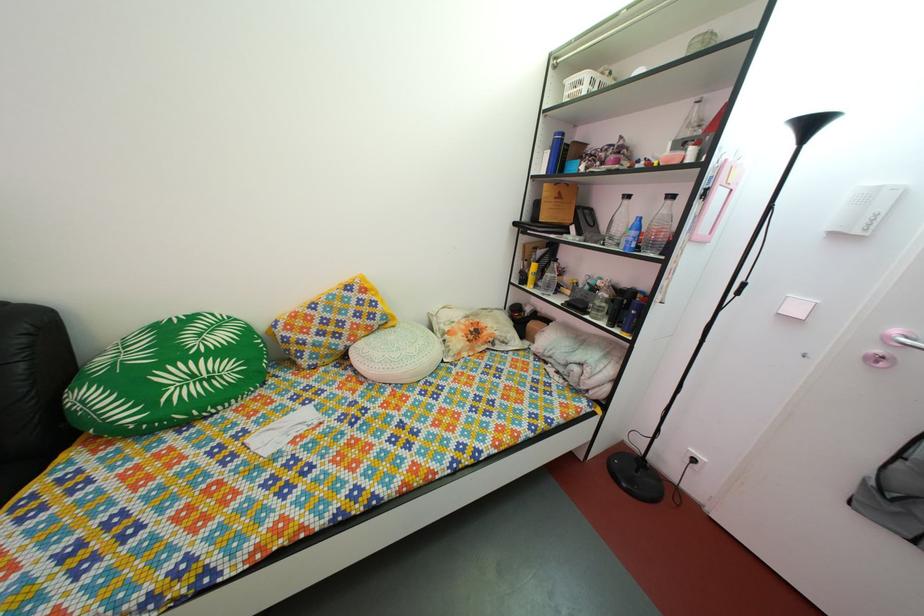
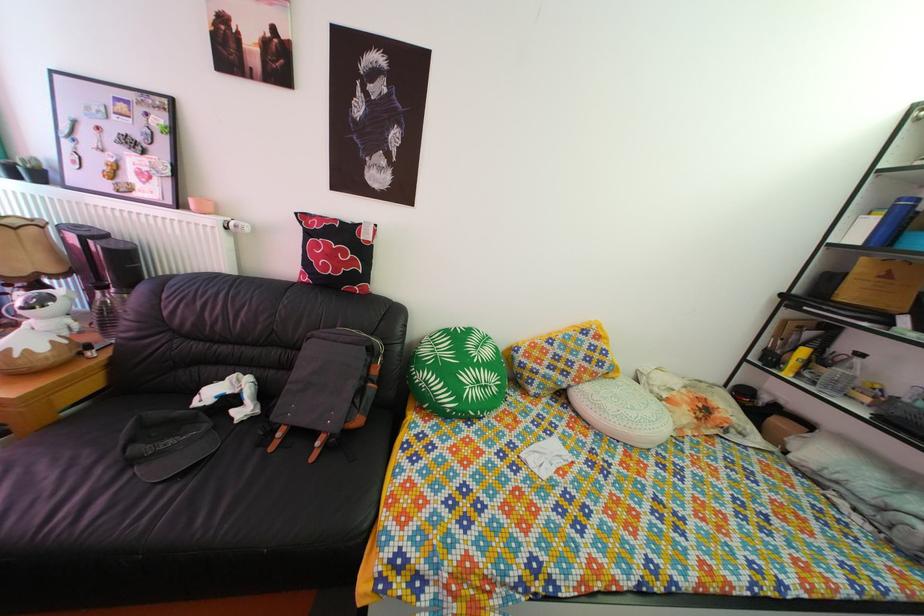
In the second image, find the point that corresponds to [220,387] in the first image.

(494, 395)